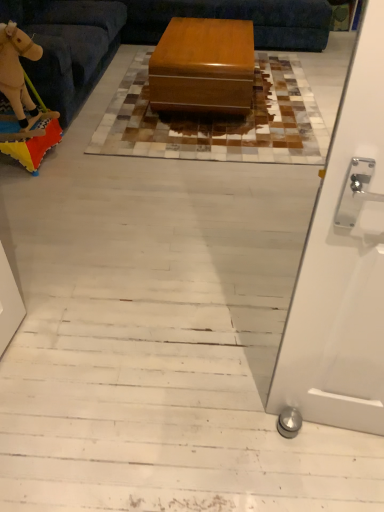
You are a GUI agent. You are given a task and a screenshot of the screen. Output one action in this format:
    pyautogui.click(x=<x>, y=<y>)
    Task: Click on the glossy wood table at center
    Image resolution: width=384 pixels, height=512 pixels.
    Given the screenshot: What is the action you would take?
    pyautogui.click(x=203, y=66)

What do you see at coordinates (73, 50) in the screenshot?
I see `wooden toy horse at left` at bounding box center [73, 50].

Find the location of `velvet blue couch at upper center`. velvet blue couch at upper center is located at coordinates (151, 34).

Does light brown plush toy at left touch velvety beige rocking horse at left?

Yes, light brown plush toy at left is with velvety beige rocking horse at left.

Between light brown plush toy at left and velvety beige rocking horse at left, which one has smaller width?

Thinner between the two is light brown plush toy at left.

Can you confirm if light brown plush toy at left is bigger than velvety beige rocking horse at left?

No, light brown plush toy at left is not bigger than velvety beige rocking horse at left.

Find the location of a particular element. The height and width of the screenshot is (512, 384). animal above the velvety beige rocking horse at left (from the image's perspective) is located at coordinates (16, 69).

Is leather-like brown mat at center facing towards light brown plush toy at left?

No, leather-like brown mat at center is not aimed at light brown plush toy at left.

Identify the location of mat to the right of light brown plush toy at left. The image size is (384, 512). (219, 121).

Is there a large distance between leather-like brown mat at center and light brown plush toy at left?

Yes, leather-like brown mat at center and light brown plush toy at left are quite far apart.

Does glossy wood table at center have a smaller size compared to light brown plush toy at left?

No.

From the image's perspective, would you say glossy wood table at center is positioned over light brown plush toy at left?

Indeed, from the image's perspective, glossy wood table at center is shown above light brown plush toy at left.

Consider the image. Do you think glossy wood table at center is within light brown plush toy at left, or outside of it?

glossy wood table at center is located beyond the bounds of light brown plush toy at left.

From a real-world perspective, between glossy wood table at center and light brown plush toy at left, who is vertically lower?

glossy wood table at center.

Are leather-like brown mat at center and velvety beige rocking horse at left far apart?

Actually, leather-like brown mat at center and velvety beige rocking horse at left are a little close together.

Between point (285, 98) and point (27, 38), which one is positioned behind?

Positioned behind is point (285, 98).

From a real-world perspective, which object stands above the other?

From a 3D spatial view, velvety beige rocking horse at left is above.

Which of these two, leather-like brown mat at center or velvety beige rocking horse at left, is thinner?

velvety beige rocking horse at left is thinner.

Locate an element on the screen. This screenshot has height=512, width=384. toy that appears above the glossy wood table at center (from a real-world perspective) is located at coordinates (23, 103).

From the image's perspective, relative to velvety beige rocking horse at left, is glossy wood table at center above or below?

glossy wood table at center is above velvety beige rocking horse at left.

Considering the sizes of objects glossy wood table at center and velvety beige rocking horse at left in the image provided, who is shorter, glossy wood table at center or velvety beige rocking horse at left?

With less height is glossy wood table at center.

Which object is wider, velvety beige rocking horse at left or velvet blue couch at upper center?

Wider between the two is velvet blue couch at upper center.

Considering the points (28, 54) and (321, 5), which point is in front, point (28, 54) or point (321, 5)?

Point (28, 54)

From a real-world perspective, is velvety beige rocking horse at left beneath velvet blue couch at upper center?

No.

Can you confirm if glossy wood table at center is smaller than wooden toy horse at left?

Yes.

From the image's perspective, between glossy wood table at center and wooden toy horse at left, who is located below?

glossy wood table at center, from the image's perspective.

Is glossy wood table at center further to camera compared to wooden toy horse at left?

Yes, glossy wood table at center is behind wooden toy horse at left.

Based on the photo, is glossy wood table at center far from wooden toy horse at left?

No.

I want to click on toy on the right of the light brown plush toy at left, so click(x=23, y=103).

I want to click on mat lying above the light brown plush toy at left (from the image's perspective), so click(219, 121).

Which object lies further to the anchor point light brown plush toy at left, velvety beige rocking horse at left or velvet blue couch at upper center?

Based on the image, velvet blue couch at upper center appears to be further to light brown plush toy at left.

Based on their spatial positions, is wooden toy horse at left or light brown plush toy at left closer to velvet blue couch at upper center?

wooden toy horse at left.

Looking at the image, which one is located closer to light brown plush toy at left, wooden toy horse at left or leather-like brown mat at center?

The object closer to light brown plush toy at left is wooden toy horse at left.

Which object lies nearer to the anchor point leather-like brown mat at center, wooden toy horse at left or velvet blue couch at upper center?

wooden toy horse at left.

Based on their spatial positions, is glossy wood table at center or velvety beige rocking horse at left closer to velvet blue couch at upper center?

velvety beige rocking horse at left lies closer to velvet blue couch at upper center than the other object.

Looking at the image, which one is located further to wooden toy horse at left, velvety beige rocking horse at left or glossy wood table at center?

glossy wood table at center lies further to wooden toy horse at left than the other object.

Looking at the image, which one is located closer to glossy wood table at center, velvet blue couch at upper center or velvety beige rocking horse at left?

velvet blue couch at upper center is positioned closer to the anchor glossy wood table at center.

Which object lies nearer to the anchor point wooden toy horse at left, leather-like brown mat at center or velvet blue couch at upper center?

Based on the image, velvet blue couch at upper center appears to be nearer to wooden toy horse at left.

This screenshot has width=384, height=512. I want to click on animal situated between wooden toy horse at left and velvet blue couch at upper center from left to right, so click(x=16, y=69).

Locate an element on the screen. The image size is (384, 512). animal between velvet blue couch at upper center and velvety beige rocking horse at left vertically is located at coordinates (16, 69).

Where is `couch between wooden toy horse at left and leather-like brown mat at center from left to right`? Image resolution: width=384 pixels, height=512 pixels. couch between wooden toy horse at left and leather-like brown mat at center from left to right is located at coordinates (151, 34).

Where is `furniture between velvet blue couch at upper center and velvety beige rocking horse at left in the up-down direction`? The width and height of the screenshot is (384, 512). furniture between velvet blue couch at upper center and velvety beige rocking horse at left in the up-down direction is located at coordinates (73, 50).